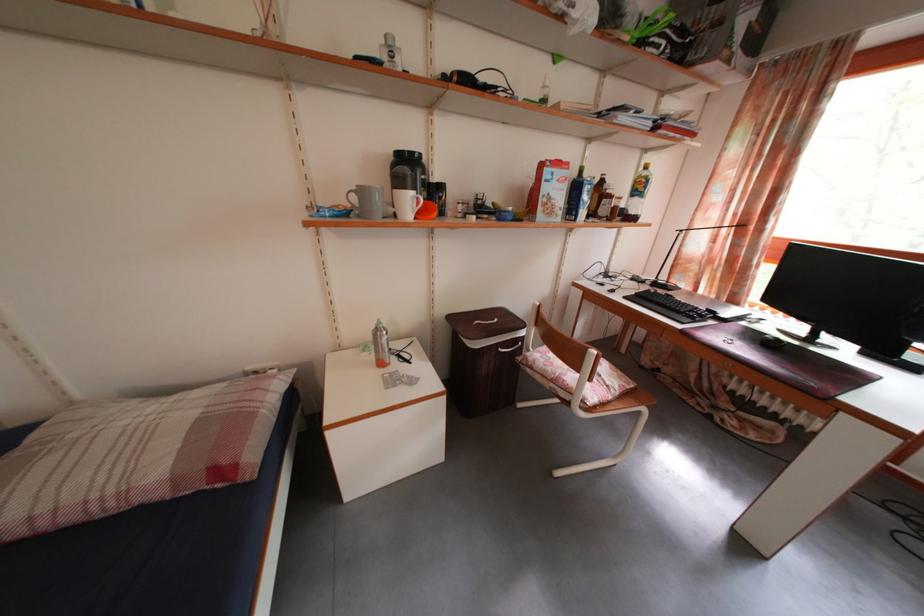
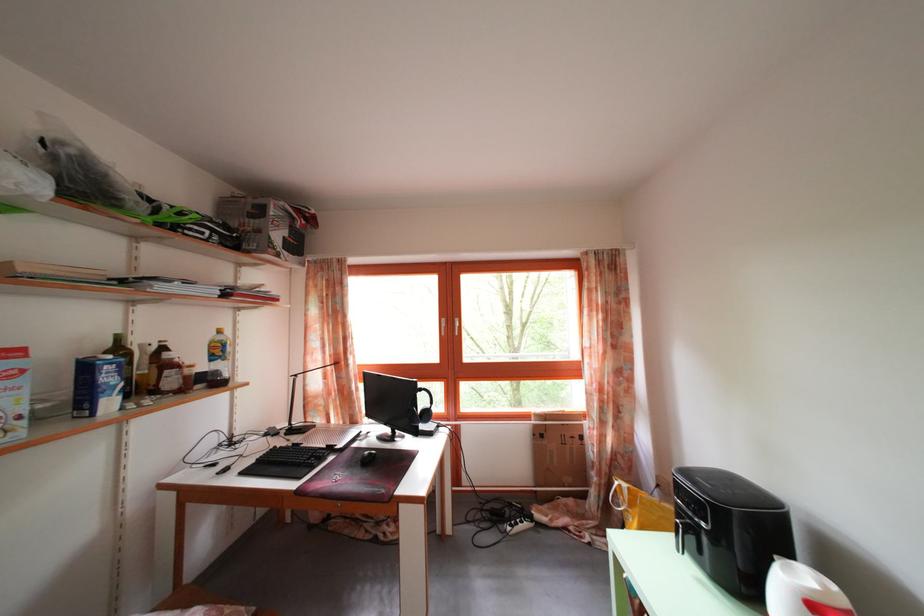
Locate, in the second image, the point that corresponds to pixel 647 195 in the first image.

(225, 359)